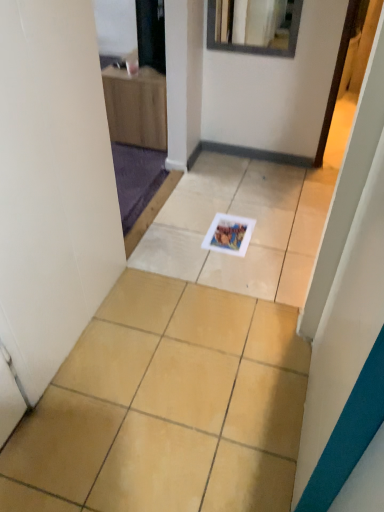
The image size is (384, 512). What are the coordinates of `free space on the front side of white glossy magazine at center` in the screenshot? It's located at (236, 270).